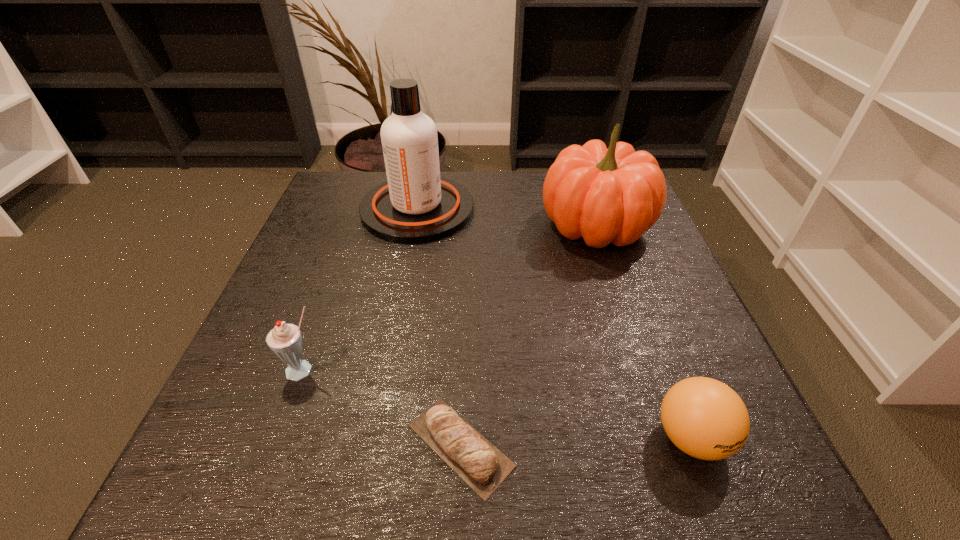
The height and width of the screenshot is (540, 960). In order to click on cleansing agent in this screenshot , I will do `click(415, 205)`.

Find the location of a particular element. This screenshot has width=960, height=540. the second tallest object is located at coordinates (615, 195).

You are a GUI agent. You are given a task and a screenshot of the screen. Output one action in this format:
    pyautogui.click(x=<x>, y=<y>)
    Task: Click on the third farthest object
    
    Given the screenshot: What is the action you would take?
    pyautogui.click(x=285, y=340)

Locate an element on the screen. This screenshot has width=960, height=540. the third tallest object is located at coordinates (285, 340).

Locate an element on the screen. This screenshot has width=960, height=540. ping-pong ball is located at coordinates (706, 419).

You are a GUI agent. You are given a task and a screenshot of the screen. Output one action in this format:
    pyautogui.click(x=<x>, y=<y>)
    Task: Click on the shortest object
    This screenshot has height=540, width=960.
    Given the screenshot: What is the action you would take?
    pyautogui.click(x=471, y=455)

In order to click on free space located on the right of the tallest object in this screenshot , I will do point(555,210).

Locate an element on the screen. The width and height of the screenshot is (960, 540). vacant space located on the front of the pumpkin is located at coordinates (633, 339).

Locate an element on the screen. The image size is (960, 540). vacant area situated on the straw side of the milkshake is located at coordinates (271, 462).

Find the location of `vacant space located on the back of the shortest object`. vacant space located on the back of the shortest object is located at coordinates point(464,362).